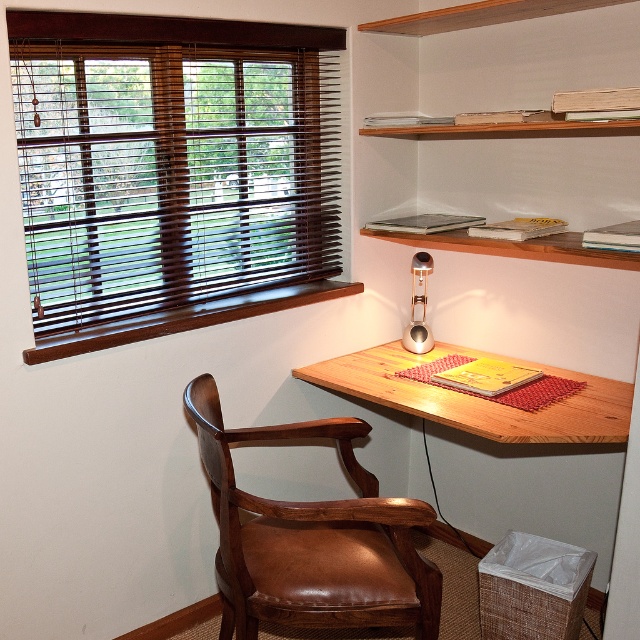
You are standing in the room and looking at the workspace. There are two points marked on the desk surface, one at point coordinates point (307, 506) and another at point coordinates point (566, 369). Which point is closer to you?

Point (307, 506) is closer to the viewer than point (566, 369).

You are sitting in the brown leather swivel chair at lower left and want to grab the metallic gold desk lamp at upper right. Which direction should you turn to reach it?

You should turn to your right because the metallic gold desk lamp at upper right is to the right of the brown leather swivel chair at lower left.

You are sitting in the brown leather swivel chair at lower left and want to reach the wooden table at center to grab a pen. Can you easily reach it from your current position?

The brown leather swivel chair at lower left is closer to the viewer than wooden table at center, so you may need to move closer to the wooden table at center to reach it easily.